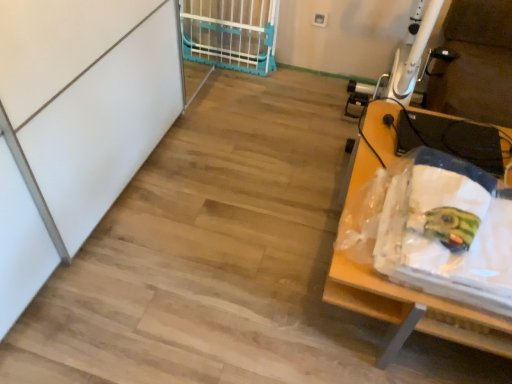
You are a GUI agent. You are given a task and a screenshot of the screen. Output one action in this format:
    pyautogui.click(x=<x>, y=<y>)
    Task: Click on the free space to the right of blue plastic gate at upper center
    The height and width of the screenshot is (384, 512).
    Given the screenshot: What is the action you would take?
    pyautogui.click(x=290, y=84)